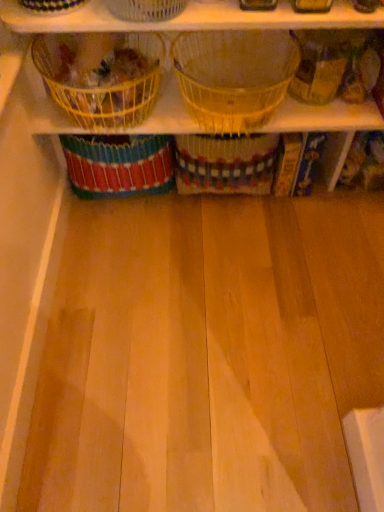
Question: In terms of size, does clear plastic basket at upper center, the 2th basket when ordered from right to left, appear bigger or smaller than yellow wire basket at upper left, positioned as the third basket in right-to-left order?

Choices:
 (A) big
 (B) small

Answer: (B)

Question: Considering their positions, is clear plastic basket at upper center, acting as the second basket starting from the left, located in front of or behind yellow wire basket at upper left, positioned as the third basket in right-to-left order?

Choices:
 (A) behind
 (B) front

Answer: (B)

Question: Estimate the real-world distances between objects in this image. Which object is farther from the translucent plastic basket at center, the first basket positioned from the right?

Choices:
 (A) clear plastic basket at upper center, the 2th basket when ordered from right to left
 (B) yellow wire basket at upper left, which appears as the first basket when viewed from the left

Answer: (A)

Question: Estimate the real-world distances between objects in this image. Which object is farther from the clear plastic basket at upper center, the 2th basket when ordered from right to left?

Choices:
 (A) translucent plastic basket at center, which is the 3th basket in left-to-right order
 (B) yellow wire basket at upper left, positioned as the third basket in right-to-left order

Answer: (A)